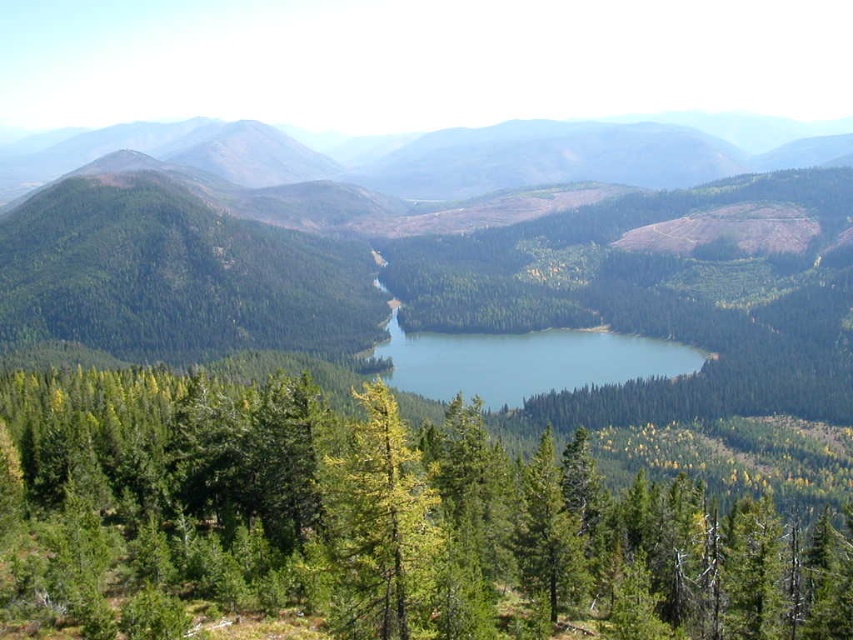
Question: Which point appears farthest from the camera in this image?

Choices:
 (A) (126, 403)
 (B) (614, 358)
 (C) (370, 506)

Answer: (B)

Question: Is green matte tree at center closer to the viewer compared to blue glossy water at center?

Choices:
 (A) no
 (B) yes

Answer: (B)

Question: From the image, what is the correct spatial relationship of yellow-green needle-like tree at center in relation to blue glossy water at center?

Choices:
 (A) left
 (B) right

Answer: (A)

Question: Which point is closer to the camera taking this photo?

Choices:
 (A) (671, 368)
 (B) (700, 486)

Answer: (B)

Question: Can you confirm if green matte tree at center is positioned to the left of yellow-green needle-like tree at center?

Choices:
 (A) yes
 (B) no

Answer: (B)

Question: Which point is farther to the camera?

Choices:
 (A) (380, 513)
 (B) (578, 374)
 (C) (103, 378)

Answer: (B)